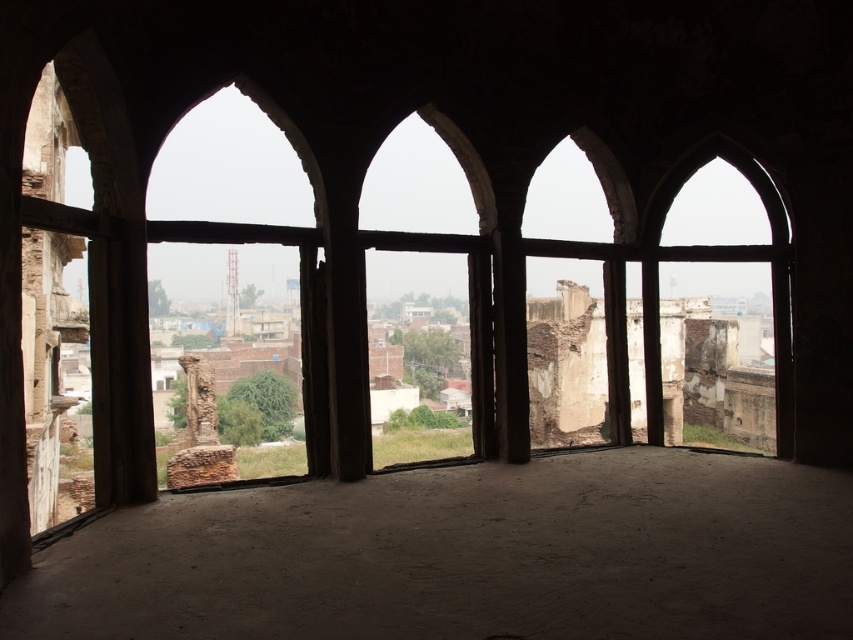
Is matte stone window at left further to the viewer compared to matte stone window at right?

No, it is not.

Does matte stone window at left appear under matte stone window at right?

No.

Does point (221, 96) come in front of point (784, 365)?

That is False.

You are a GUI agent. You are given a task and a screenshot of the screen. Output one action in this format:
    pyautogui.click(x=<x>, y=<y>)
    Task: Click on the matte stone window at left
    This screenshot has height=640, width=853.
    Given the screenshot: What is the action you would take?
    pos(228,168)

Can you confirm if matte stone window at center is taller than matte stone window at left?

In fact, matte stone window at center may be shorter than matte stone window at left.

Is matte stone window at center shorter than matte stone window at left?

Correct, matte stone window at center is not as tall as matte stone window at left.

Between point (416, 372) and point (273, 328), which one is positioned behind?

Point (273, 328)

You are a GUI agent. You are given a task and a screenshot of the screen. Output one action in this format:
    pyautogui.click(x=<x>, y=<y>)
    Task: Click on the matte stone window at center
    
    Given the screenshot: What is the action you would take?
    click(432, 273)

Which of these two, matte stone window at center or matte stone window at right, stands shorter?

With less height is matte stone window at right.

Can you confirm if matte stone window at center is positioned to the left of matte stone window at right?

Yes, matte stone window at center is to the left of matte stone window at right.

The width and height of the screenshot is (853, 640). I want to click on matte stone window at center, so click(x=432, y=273).

Where is `matte stone window at center`? matte stone window at center is located at coordinates (432, 273).